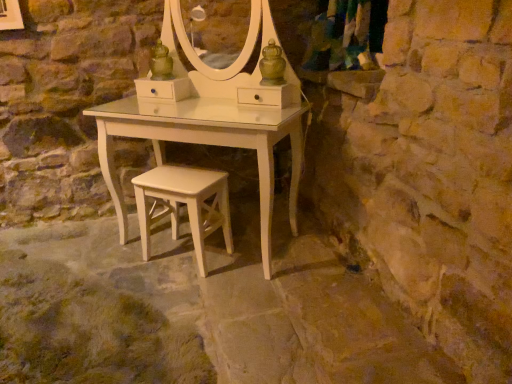
This screenshot has height=384, width=512. What are the coordinates of `free point above light beige wood stool at center (from a real-world perspective)` in the screenshot? It's located at (170, 180).